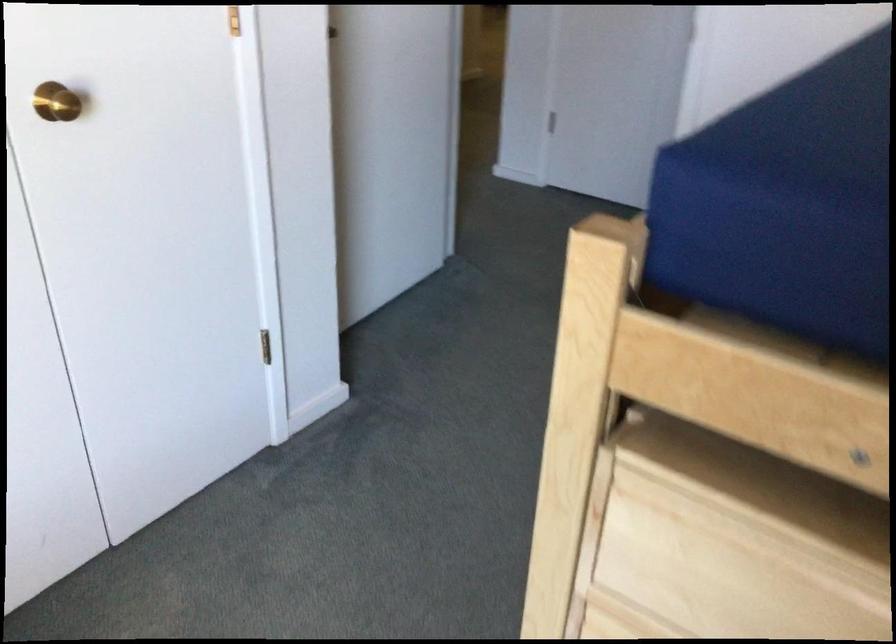
What do you see at coordinates (56, 102) in the screenshot? I see `a gold door knob` at bounding box center [56, 102].